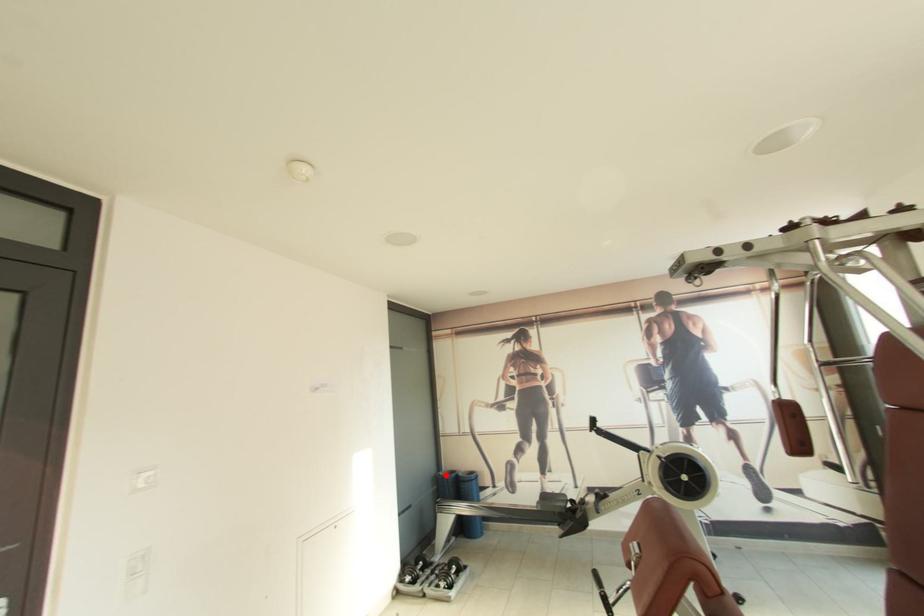
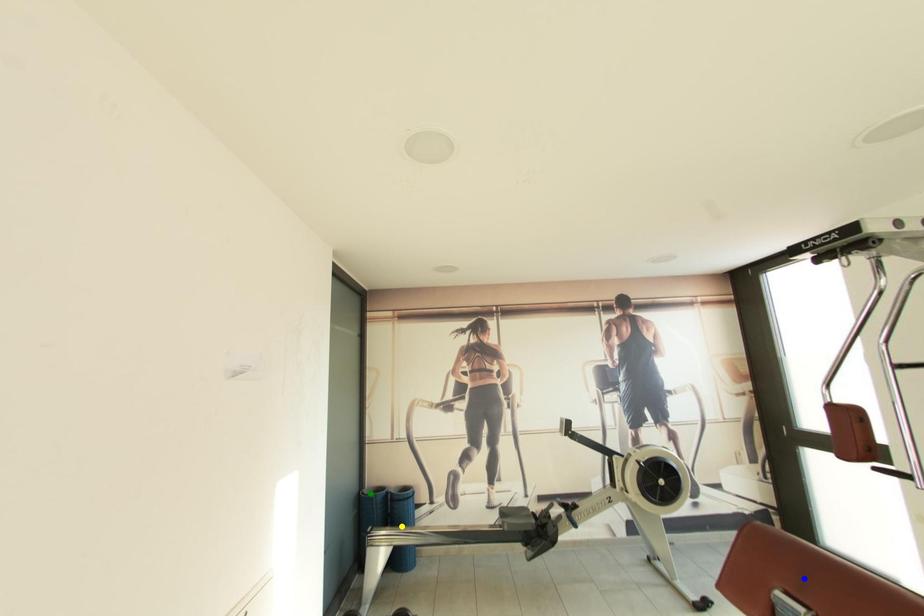
Question: I am providing you with two images of the same scene from different viewpoints. A red point is marked on the first image. You are given multiple points on the second image. Can you choose the point in image 2 that corresponds to the point in image 1?

Choices:
 (A) blue point
 (B) yellow point
 (C) green point

Answer: (C)